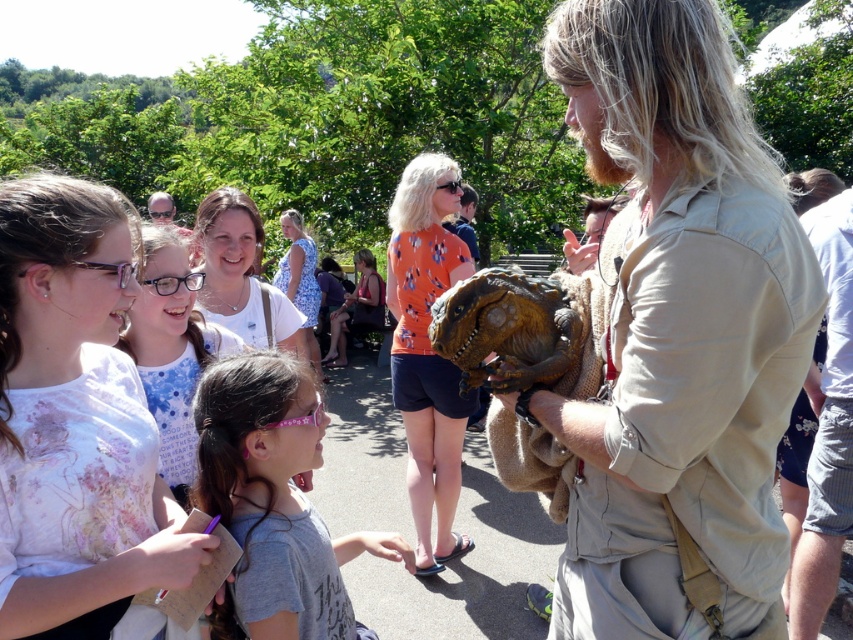
Question: Does light pink floral shirt at upper left appear on the left side of orange fabric dinosaur head at center?

Choices:
 (A) yes
 (B) no

Answer: (A)

Question: Which point appears farthest from the camera in this image?

Choices:
 (A) (850, 305)
 (B) (277, 413)

Answer: (A)

Question: Is orange fabric dinosaur head at center to the left of blue floral dress at center from the viewer's perspective?

Choices:
 (A) no
 (B) yes

Answer: (A)

Question: Which is nearer to the matte black sunglasses at upper left?

Choices:
 (A) light pink floral shirt at upper left
 (B) brown textured dinosaur puppet at center
 (C) brown textured shirt at center
 (D) beige cotton shirt at center

Answer: (B)

Question: Estimate the real-world distances between objects in this image. Which object is farther from the blue floral dress at center?

Choices:
 (A) beige cotton shirt at center
 (B) matte black sunglasses at upper left
 (C) white dotted shirt at upper left
 (D) orange fabric dinosaur head at center

Answer: (A)

Question: Is orange fabric at center positioned behind brown textured dinosaur puppet at center?

Choices:
 (A) no
 (B) yes

Answer: (B)